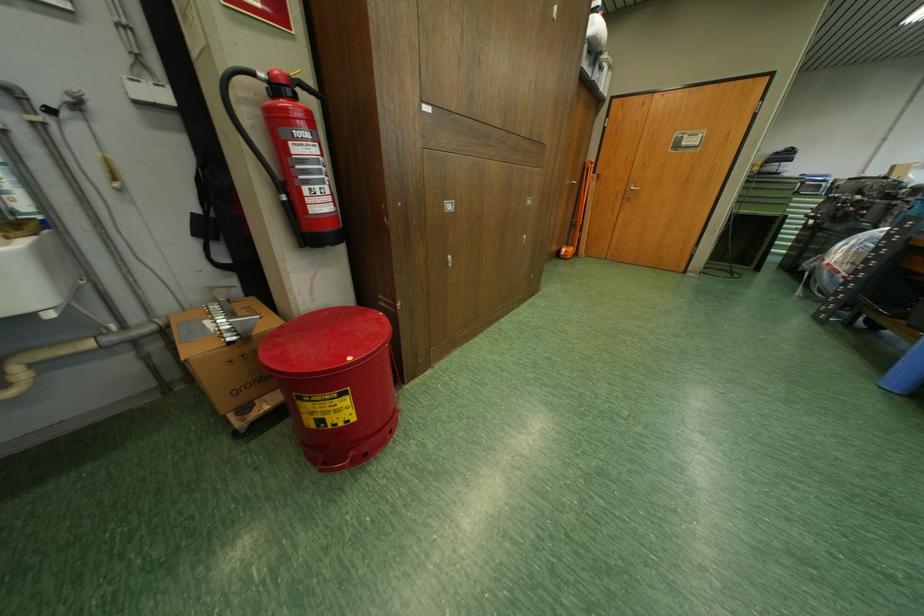
Find the location of `red can foot pedal`. red can foot pedal is located at coordinates (338, 461).